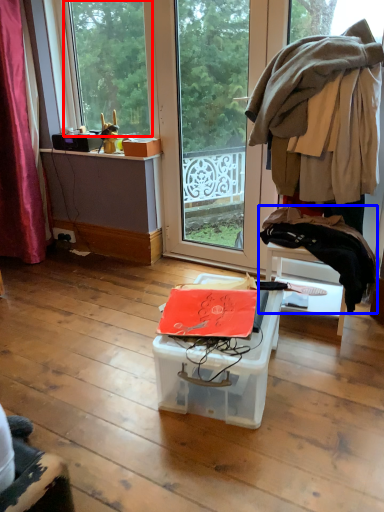
Question: Among these objects, which one is nearest to the camera, window (highlighted by a red box) or clothing (highlighted by a blue box)?

Choices:
 (A) window
 (B) clothing

Answer: (B)